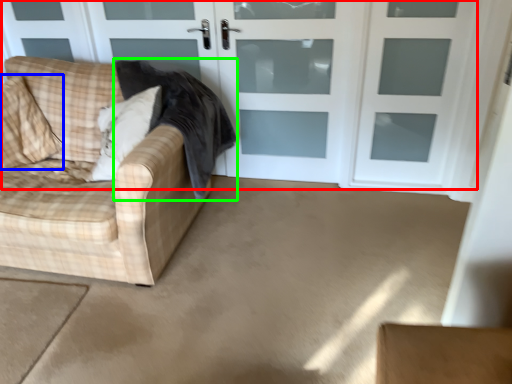
Question: Which object is the closest to the door (highlighted by a red box)? Choose among these: pillow (highlighted by a blue box) or blanket (highlighted by a green box).

Choices:
 (A) pillow
 (B) blanket

Answer: (B)